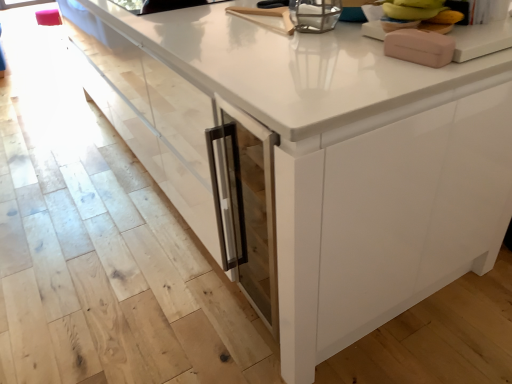
Question: Is pink matte soap dispenser at upper right, acting as the second appliance starting from the left, to the left of metallic glass container at upper center, arranged as the 1th appliance when viewed from the top, from the viewer's perspective?

Choices:
 (A) yes
 (B) no

Answer: (B)

Question: From the image's perspective, is pink matte soap dispenser at upper right, the 2th appliance from the top, located beneath metallic glass container at upper center, the second appliance viewed from the right?

Choices:
 (A) no
 (B) yes

Answer: (B)

Question: Is pink matte soap dispenser at upper right, marked as the 1th appliance in a right-to-left arrangement, oriented towards metallic glass container at upper center, acting as the first appliance starting from the left?

Choices:
 (A) no
 (B) yes

Answer: (B)

Question: Does pink matte soap dispenser at upper right, the first appliance when ordered from bottom to top, have a smaller size compared to metallic glass container at upper center, positioned as the 1th appliance in back-to-front order?

Choices:
 (A) yes
 (B) no

Answer: (A)

Question: Does pink matte soap dispenser at upper right, marked as the 1th appliance in a right-to-left arrangement, have a larger size compared to metallic glass container at upper center, the second appliance viewed from the right?

Choices:
 (A) no
 (B) yes

Answer: (A)

Question: Is pink matte soap dispenser at upper right, which is the first appliance in front-to-back order, positioned beyond the bounds of metallic glass container at upper center, acting as the first appliance starting from the left?

Choices:
 (A) yes
 (B) no

Answer: (A)

Question: From a real-world perspective, does yellow banana at upper right sit lower than pink matte soap dispenser at upper right, marked as the 1th appliance in a right-to-left arrangement?

Choices:
 (A) yes
 (B) no

Answer: (B)

Question: Considering the relative sizes of yellow banana at upper right and pink matte soap dispenser at upper right, marked as the 1th appliance in a right-to-left arrangement, in the image provided, is yellow banana at upper right wider than pink matte soap dispenser at upper right, marked as the 1th appliance in a right-to-left arrangement,?

Choices:
 (A) yes
 (B) no

Answer: (B)

Question: From a real-world perspective, is yellow banana at upper right on top of pink matte soap dispenser at upper right, the first appliance when ordered from bottom to top?

Choices:
 (A) yes
 (B) no

Answer: (A)

Question: From the image's perspective, is yellow banana at upper right on pink matte soap dispenser at upper right, the 2th appliance from the top?

Choices:
 (A) no
 (B) yes

Answer: (B)

Question: Considering the relative sizes of yellow banana at upper right and pink matte soap dispenser at upper right, which is the first appliance in front-to-back order, in the image provided, is yellow banana at upper right shorter than pink matte soap dispenser at upper right, which is the first appliance in front-to-back order,?

Choices:
 (A) yes
 (B) no

Answer: (B)

Question: Considering the relative sizes of yellow banana at upper right and pink matte soap dispenser at upper right, acting as the second appliance starting from the left, in the image provided, is yellow banana at upper right taller than pink matte soap dispenser at upper right, acting as the second appliance starting from the left,?

Choices:
 (A) no
 (B) yes

Answer: (B)

Question: Is yellow banana at upper right located within pink matte soap dispenser at upper right, marked as the 1th appliance in a right-to-left arrangement?

Choices:
 (A) no
 (B) yes

Answer: (A)